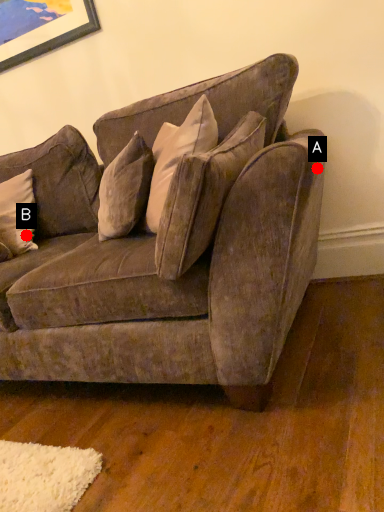
Question: Two points are circled on the image, labeled by A and B beside each circle. Which point is closer to the camera taking this photo?

Choices:
 (A) A is closer
 (B) B is closer

Answer: (A)